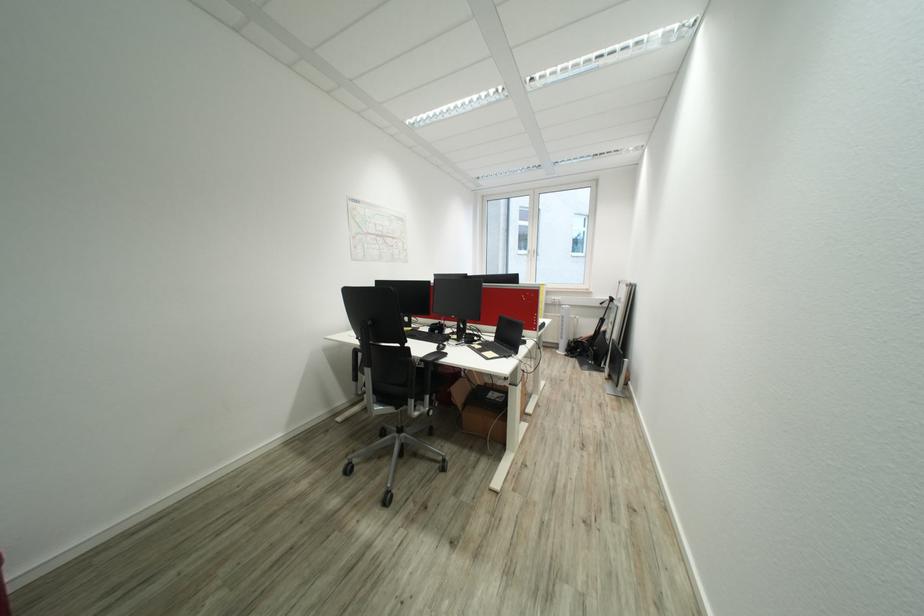
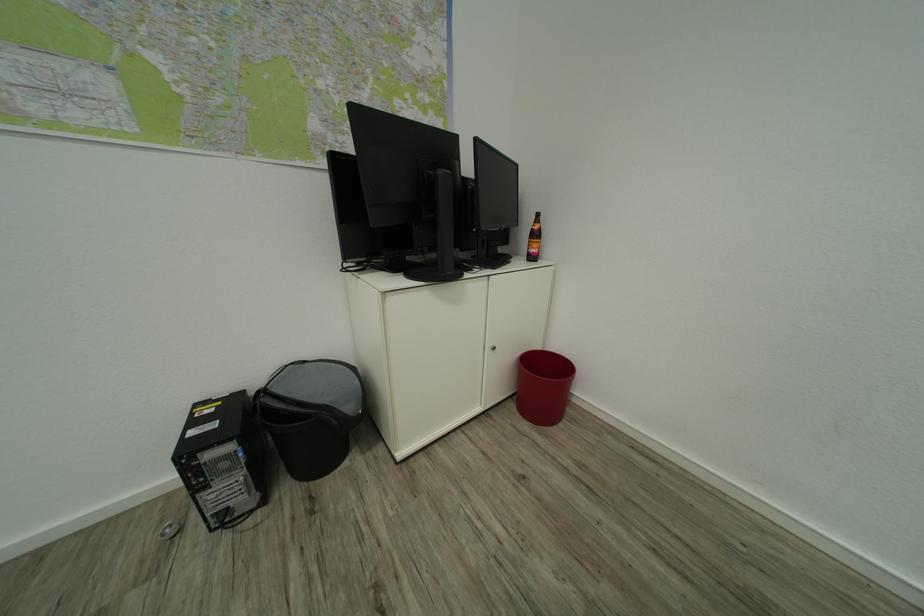
Based on the continuous images, in which direction is the camera rotating?

The camera rotated toward left-down.